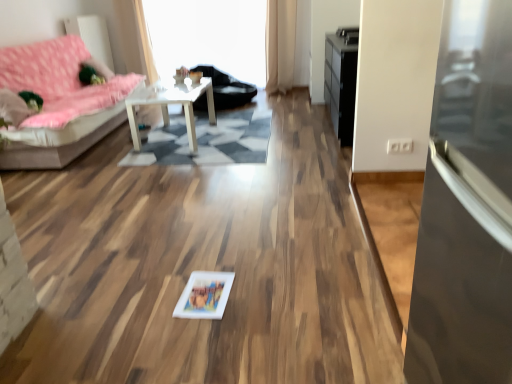
I want to click on vacant space behind white glossy picture frame at center, so click(x=208, y=261).